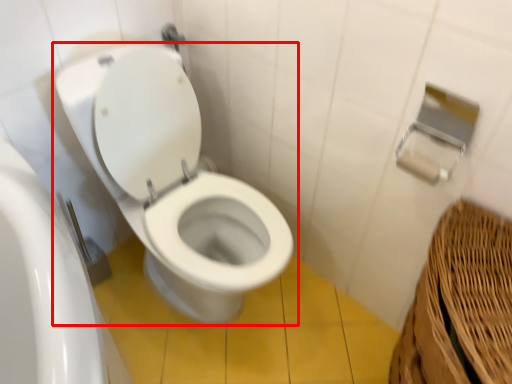
Question: From the image's perspective, considering the relative positions of toilet (annotated by the red box) and toilet paper in the image provided, where is toilet (annotated by the red box) located with respect to the staircase?

Choices:
 (A) above
 (B) below

Answer: (B)